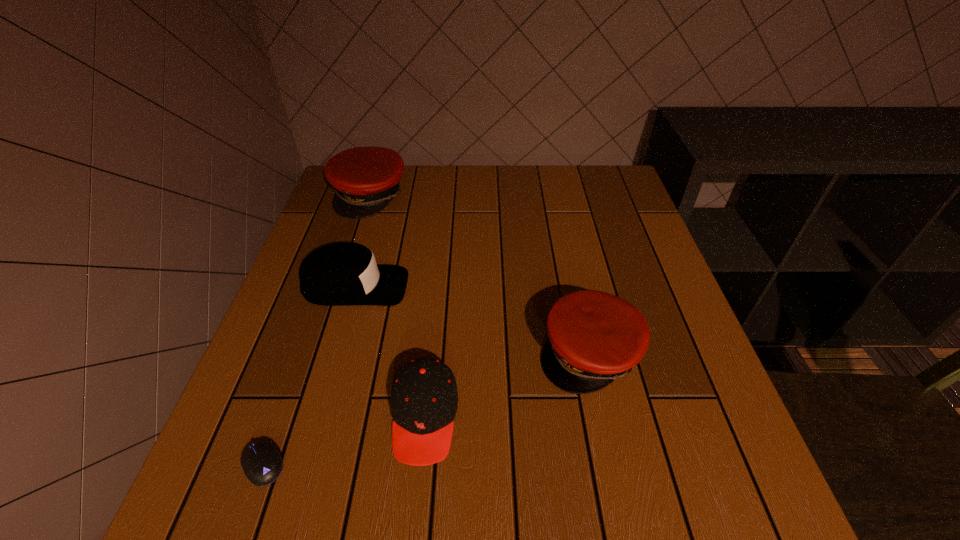
Where is `the farthest cap`? The width and height of the screenshot is (960, 540). the farthest cap is located at coordinates (365, 179).

Where is `the third nearest cap`? This screenshot has width=960, height=540. the third nearest cap is located at coordinates (341, 274).

The image size is (960, 540). I want to click on the rightmost cap, so [595, 337].

Image resolution: width=960 pixels, height=540 pixels. I want to click on the fourth object from left to right, so click(x=424, y=398).

Identify the location of computer mouse. This screenshot has height=540, width=960. click(x=262, y=464).

Where is `free space located on the front of the farthest cap with an emblem`? free space located on the front of the farthest cap with an emblem is located at coordinates (351, 254).

Identify the location of vacant area situated 0.120m on the front-facing side of the second farthest cap. (460, 286).

Find the location of a particular element. This screenshot has height=540, width=960. vacant space positioned on the front-facing side of the rightmost object is located at coordinates (604, 421).

At what (x,y) coordinates should I click in order to perform the action: click on free location located on the front-facing side of the third cap from left to right. Please return your answer as a coordinate pair (x, y). The image size is (960, 540). Looking at the image, I should click on [416, 508].

The width and height of the screenshot is (960, 540). I want to click on free region located on the right of the shortest object, so click(x=380, y=464).